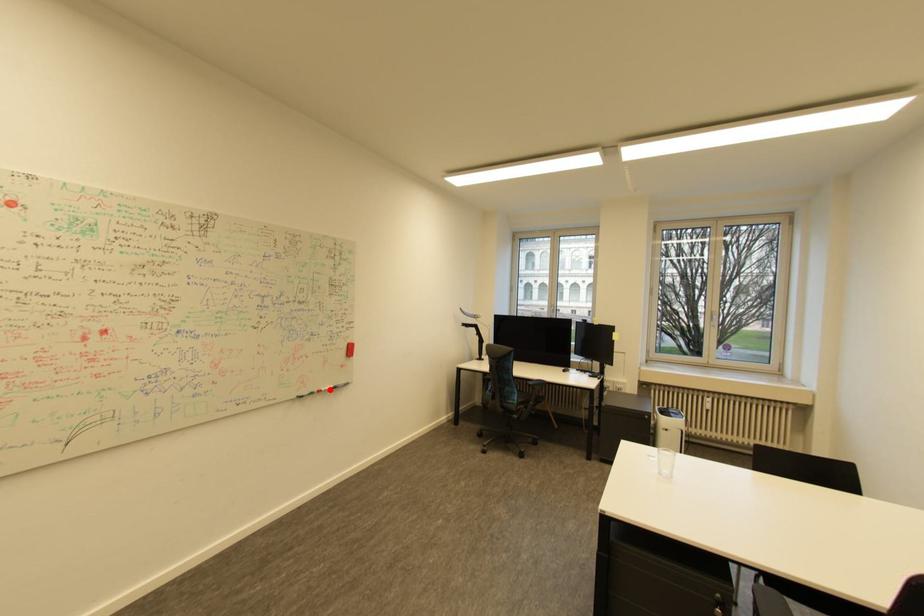
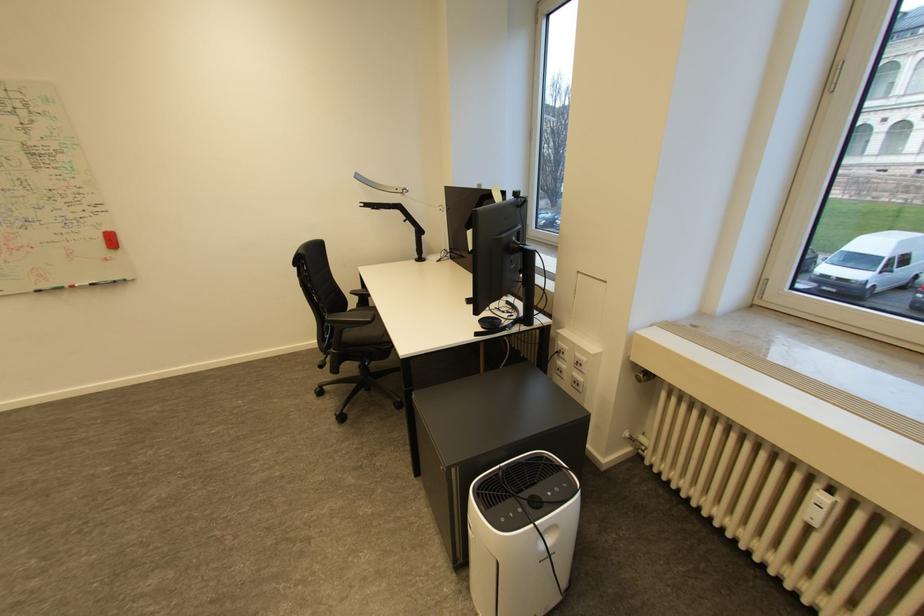
The point at the highlighted location is marked in the first image. Where is the corresponding point in the second image?

(83, 286)